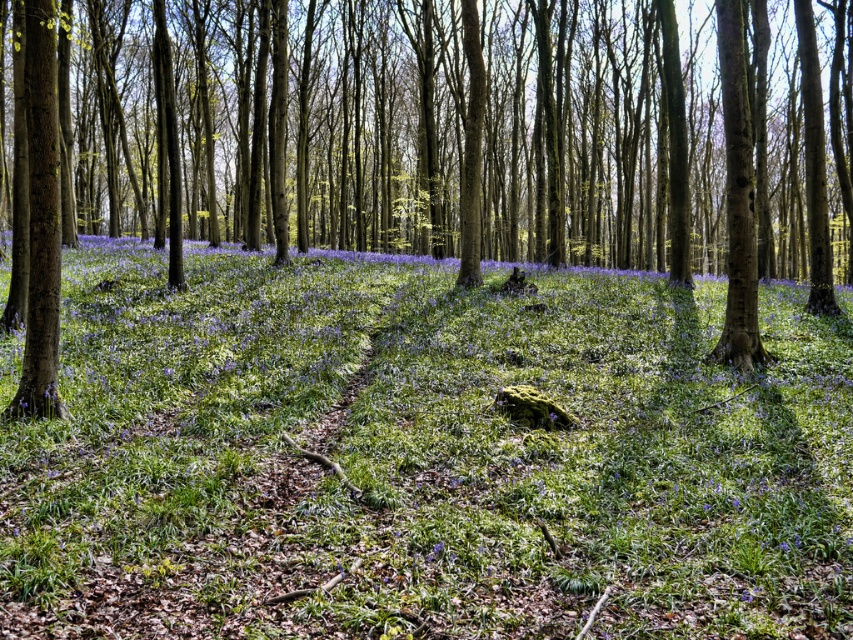
Who is lower down, green matte grass at center or brown smooth tree trunk at center?

green matte grass at center is below.

Who is more forward, (x=128, y=252) or (x=486, y=209)?

Point (x=128, y=252) is more forward.

Locate an element on the screen. Image resolution: width=853 pixels, height=640 pixels. green matte grass at center is located at coordinates (422, 456).